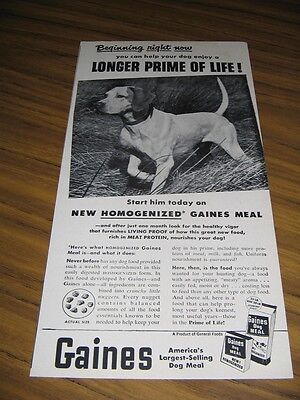
Locate an element on the screen. countertop is located at coordinates (20, 233).